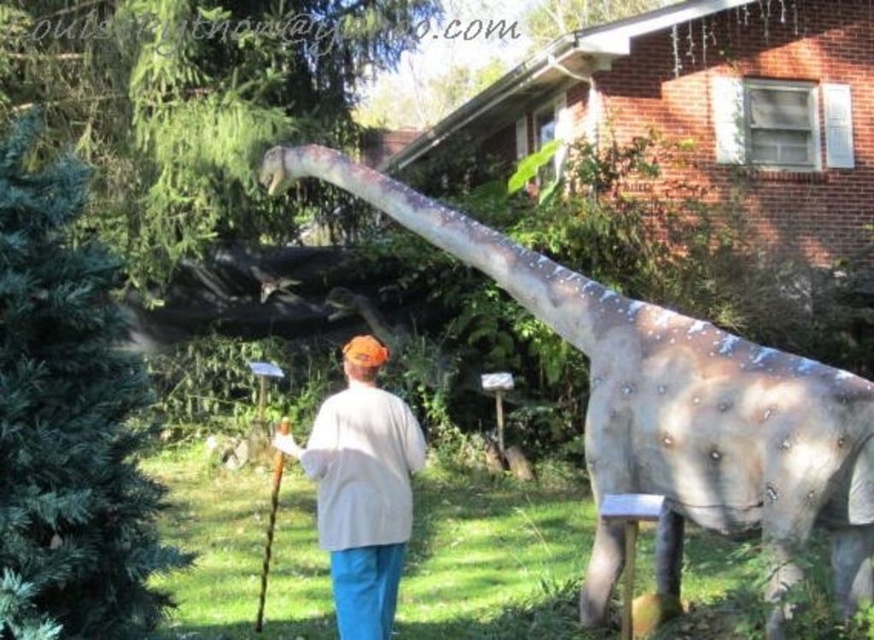
You are standing at the point labeled point (274,468) and want to walk to the dinosaur model. Is the point labeled point (696,508) between you and the dinosaur model?

Yes, the point labeled point (696,508) is between you and the dinosaur model because it is in front of point (274,468).

You are a visitor in this backyard and want to take a photo of the speckled gray dinosaur at center without the white cotton shirt at center appearing in the shot. How can you adjust your position to achieve this?

Since the speckled gray dinosaur at center is in front of the white cotton shirt at center, you can move to a position where the dinosaur blocks the view of the shirt. Alternatively, step forward so the shirt is out of frame behind the dinosaur.

You are a visitor in this backyard garden and want to take a photo of the speckled gray dinosaur at center with your smartphone. Your smartphone has a maximum zoom capability that can only focus on objects up to 1 meter wide. Can the wooden cane at center be fully captured in the photo without moving the phone?

The speckled gray dinosaur at center is wider than the wooden cane at center. Since the smartphone can focus on objects up to 1 meter wide, and the wooden cane is narrower than the dinosaur, the cane can be fully captured in the photo without moving the phone.